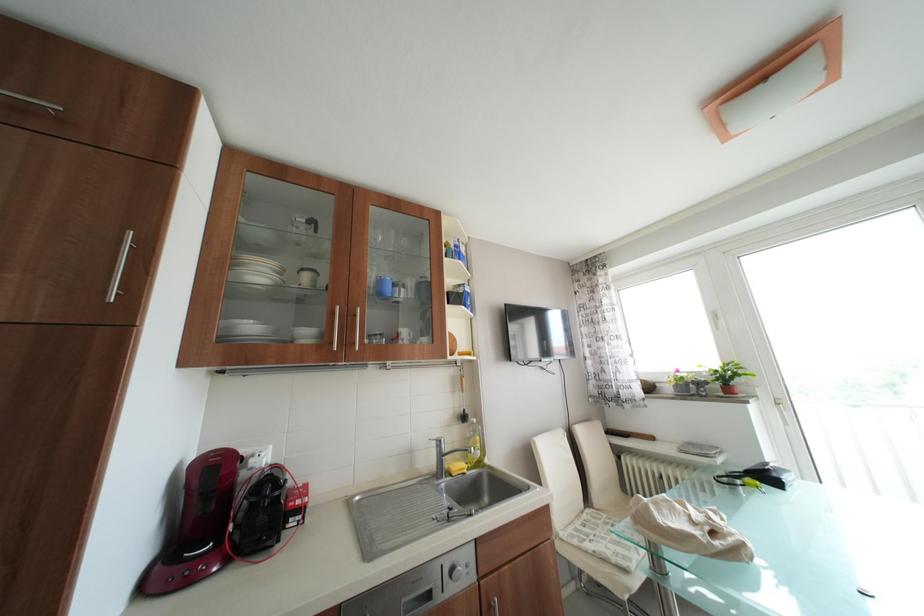
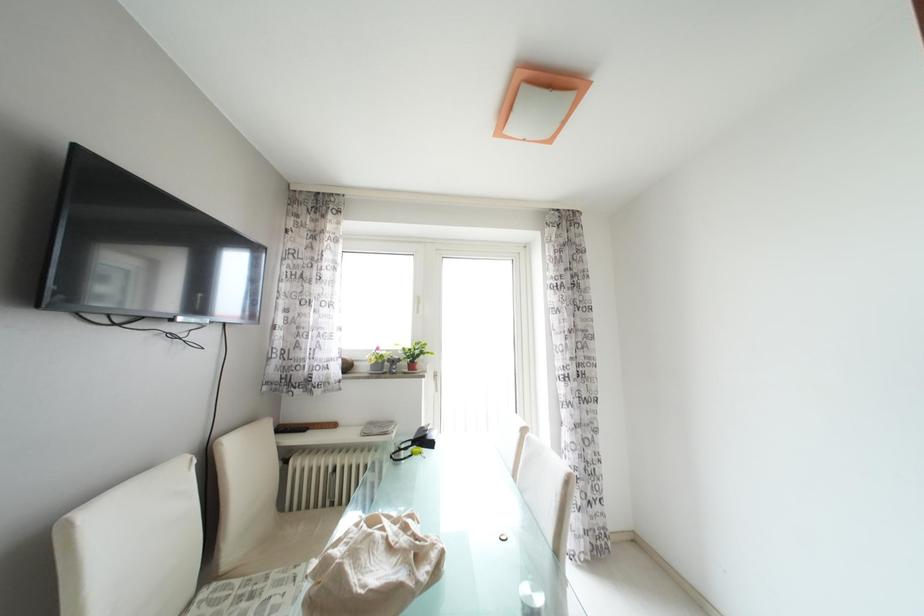
Question: The images are taken continuously from a first-person perspective. In which direction is your viewpoint rotating?

Choices:
 (A) Left
 (B) Right
 (C) Up
 (D) Down

Answer: (B)